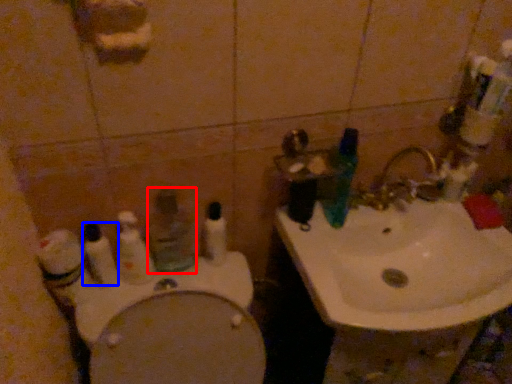
Question: Which object is closer to the camera taking this photo, mouthwash (highlighted by a red box) or toothbrush (highlighted by a blue box)?

Choices:
 (A) mouthwash
 (B) toothbrush

Answer: (B)